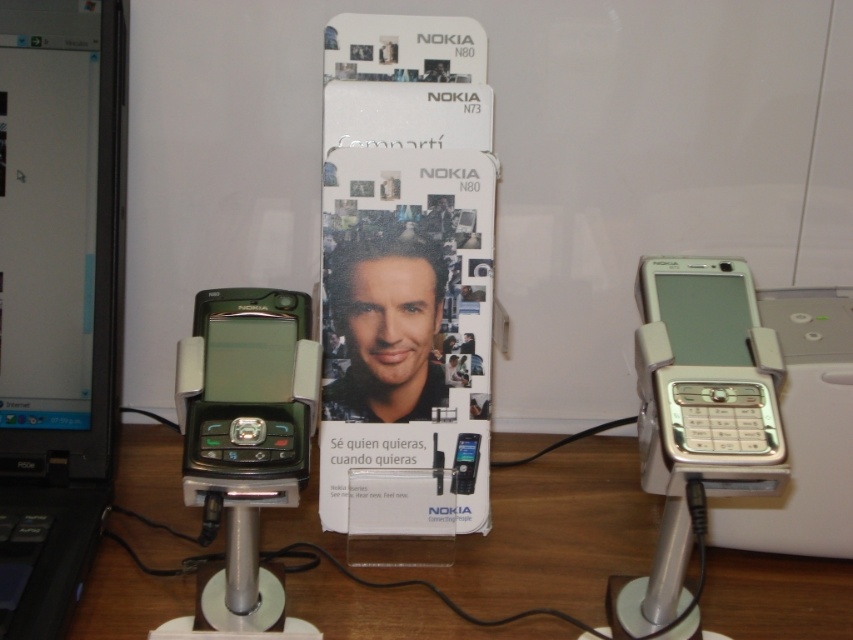
Between point (140, 429) and point (54, 627), which one is positioned behind?

Point (140, 429)

Who is more forward, (421, 608) or (105, 76)?

Point (421, 608) is in front.

The height and width of the screenshot is (640, 853). What do you see at coordinates (552, 534) in the screenshot?
I see `wooden table at center` at bounding box center [552, 534].

This screenshot has width=853, height=640. I want to click on wooden table at center, so click(x=552, y=534).

Between point (548, 570) and point (648, 406), which one is positioned behind?

The point (548, 570) is more distant.

Which is behind, point (547, 545) or point (670, 436)?

Positioned behind is point (547, 545).

At what (x,y) coordinates should I click in order to perform the action: click on wooden table at center. Please return your answer as a coordinate pair (x, y). This screenshot has width=853, height=640. Looking at the image, I should click on (552, 534).

Is point (152, 516) closer to camera compared to point (461, 445)?

That is False.

Does wooden table at center have a smaller size compared to matte black phone at center?

No.

Is point (608, 497) closer to viewer compared to point (460, 445)?

No.

Where is `wooden table at center`? The width and height of the screenshot is (853, 640). wooden table at center is located at coordinates (552, 534).